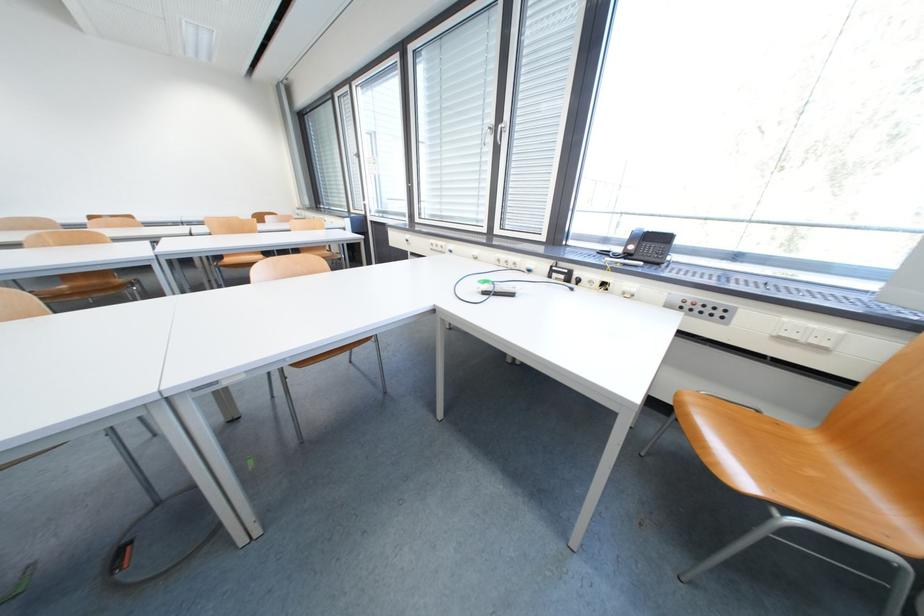
At what (x,y) coordinates should I click in order to perform the action: click on telephone buttons. Please return your answer as a coordinate pair (x, y). Looking at the image, I should click on (700, 308).